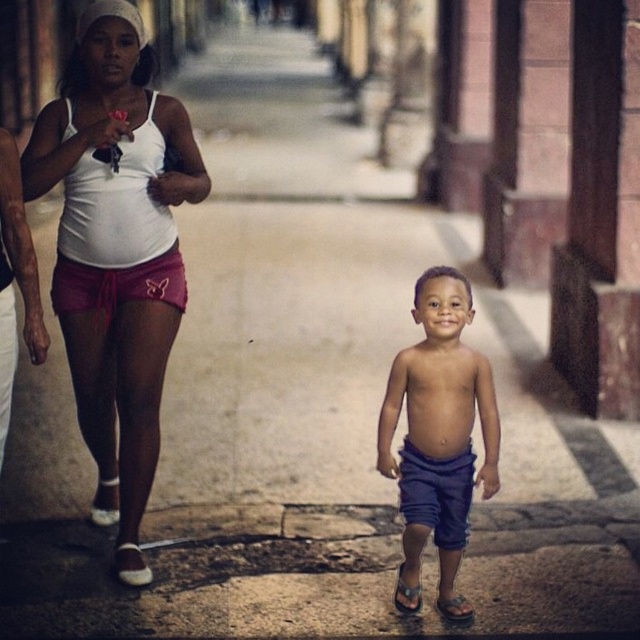
Between point (154, 145) and point (433, 332), which one is positioned behind?

Point (154, 145)

Who is taller, white matte tank top at upper left or blue denim shorts at center?

white matte tank top at upper left

This screenshot has width=640, height=640. What do you see at coordinates (116, 252) in the screenshot?
I see `white matte tank top at upper left` at bounding box center [116, 252].

Locate an element on the screen. This screenshot has height=640, width=640. white matte tank top at upper left is located at coordinates (116, 252).

Between point (160, 358) and point (10, 396), which one is positioned behind?

The point (160, 358) is more distant.

From the picture: Does white matte tank top at upper left have a larger size compared to smooth skin torso at center?

Indeed, white matte tank top at upper left has a larger size compared to smooth skin torso at center.

What do you see at coordinates (116, 252) in the screenshot? I see `white matte tank top at upper left` at bounding box center [116, 252].

Identify the location of white matte tank top at upper left. (116, 252).

Can you confirm if blue denim shorts at center is positioned above smooth skin torso at center?

No, blue denim shorts at center is not above smooth skin torso at center.

Between point (449, 394) and point (3, 396), which one is positioned in front?

Positioned in front is point (3, 396).

Where is `blue denim shorts at center`? This screenshot has height=640, width=640. blue denim shorts at center is located at coordinates (438, 436).